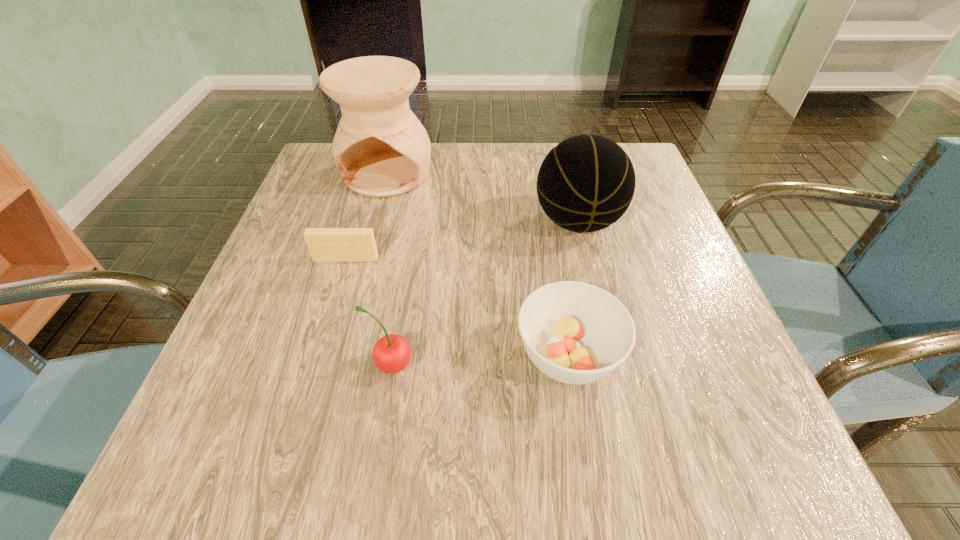
Locate an element on the screen. vacant area that satisfies the following two spatial constraints: 1. at the open side of the third tallest object; 2. on the left side of the pottery is located at coordinates (336, 366).

Find the location of a particular element. The height and width of the screenshot is (540, 960). free location that satisfies the following two spatial constraints: 1. at the open side of the cherry; 2. on the right side of the pottery is located at coordinates (336, 366).

I want to click on free space that satisfies the following two spatial constraints: 1. at the open side of the tallest object; 2. on the left side of the fourth shortest object, so click(x=374, y=222).

I want to click on free location that satisfies the following two spatial constraints: 1. at the open side of the cherry; 2. on the right side of the pottery, so click(x=336, y=366).

Locate an element on the screen. Image resolution: width=960 pixels, height=540 pixels. free location that satisfies the following two spatial constraints: 1. at the front of the shortest object with spools; 2. on the left side of the soup bowl is located at coordinates (317, 355).

Locate an element on the screen. The height and width of the screenshot is (540, 960). free space in the image that satisfies the following two spatial constraints: 1. on the back side of the second shortest object; 2. on the right side of the basketball is located at coordinates (546, 222).

This screenshot has height=540, width=960. Find the location of `free region that satisfies the following two spatial constraints: 1. at the front of the cherry with spools; 2. on the right side of the shortest object`. free region that satisfies the following two spatial constraints: 1. at the front of the cherry with spools; 2. on the right side of the shortest object is located at coordinates (314, 366).